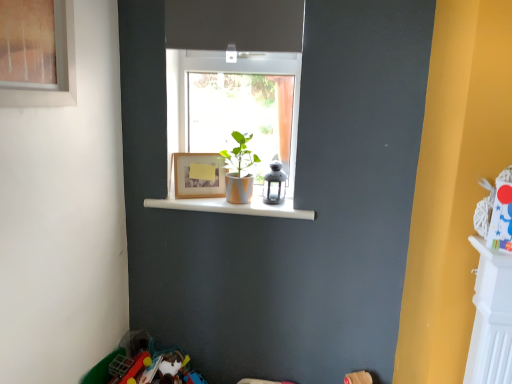
Question: Based on their sizes in the image, would you say white glossy shelf at center is bigger or smaller than matte orange pot at center?

Choices:
 (A) small
 (B) big

Answer: (B)

Question: Is white glossy shelf at center in front of or behind matte orange pot at center in the image?

Choices:
 (A) behind
 (B) front

Answer: (A)

Question: Which object is positioned farthest from the wooden frame at center?

Choices:
 (A) matte wooden frame at upper left
 (B) matte orange pot at center
 (C) matte black lantern at upper center
 (D) white glossy shelf at center

Answer: (A)

Question: Which object is the farthest from the matte orange pot at center?

Choices:
 (A) white glossy shelf at center
 (B) matte black lantern at upper center
 (C) matte wooden frame at upper left
 (D) wooden frame at center

Answer: (C)